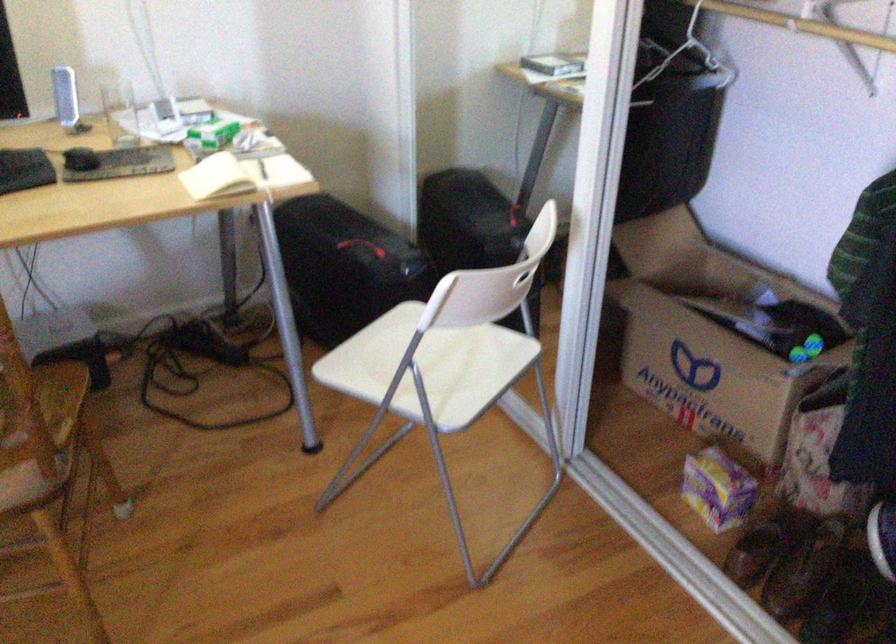
I want to click on chair back handle, so click(x=528, y=269).